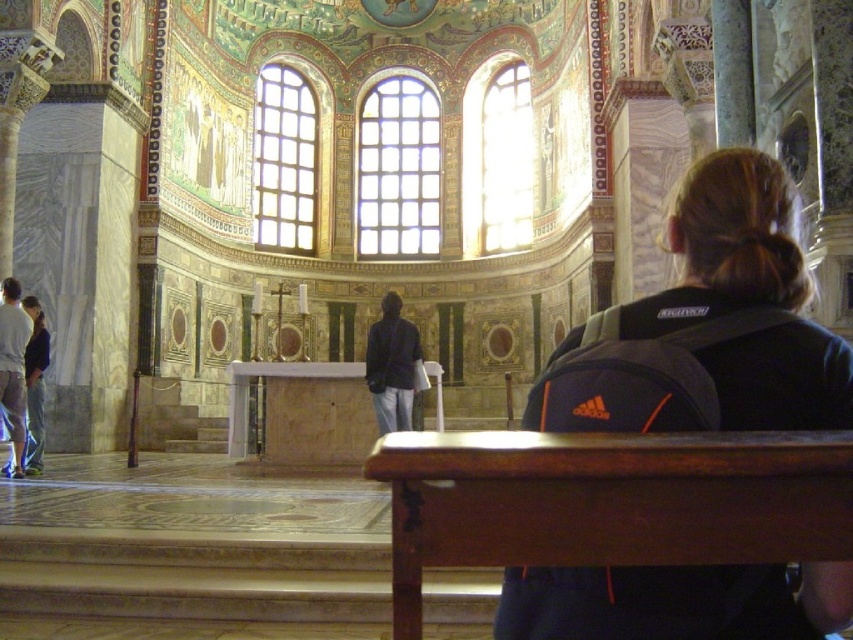
Is black fabric backpack at upper right wider than dark blue jacket at center?

Correct, the width of black fabric backpack at upper right exceeds that of dark blue jacket at center.

Does point (683, 608) lie behind point (408, 374)?

No, it is in front of (408, 374).

Who is more forward, [761,188] or [373,388]?

Point [761,188] is in front.

You are a GUI agent. You are given a task and a screenshot of the screen. Output one action in this format:
    pyautogui.click(x=<x>, y=<y>)
    Task: Click on the black fabric backpack at upper right
    The width and height of the screenshot is (853, 640).
    Given the screenshot: What is the action you would take?
    pyautogui.click(x=711, y=320)

Is dark brown polished wood altar at center closer to the viewer compared to light gray jeans at left?

Yes, dark brown polished wood altar at center is in front of light gray jeans at left.

Can you confirm if dark brown polished wood altar at center is positioned below light gray jeans at left?

Correct, dark brown polished wood altar at center is located below light gray jeans at left.

Who is more distant from viewer, (424, 515) or (19, 342)?

Point (19, 342)

Where is `dark brown polished wood altar at center`? The height and width of the screenshot is (640, 853). dark brown polished wood altar at center is located at coordinates (608, 500).

Between light gray jeans at left and denim jeans at lower left, which one has less height?

denim jeans at lower left

Which is more to the left, light gray jeans at left or denim jeans at lower left?

light gray jeans at left is more to the left.

The image size is (853, 640). What do you see at coordinates (13, 369) in the screenshot? I see `light gray jeans at left` at bounding box center [13, 369].

Image resolution: width=853 pixels, height=640 pixels. In order to click on light gray jeans at left in this screenshot , I will do `click(13, 369)`.